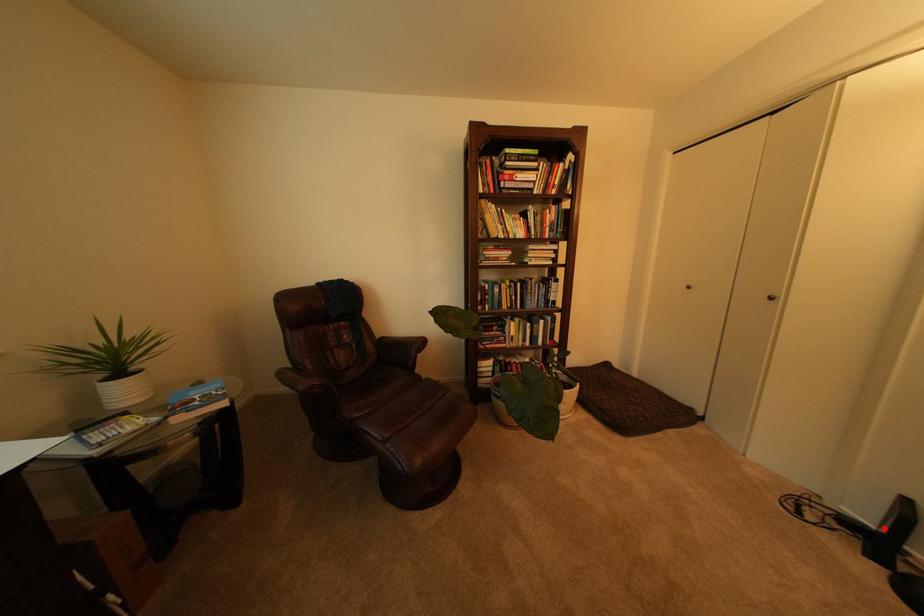
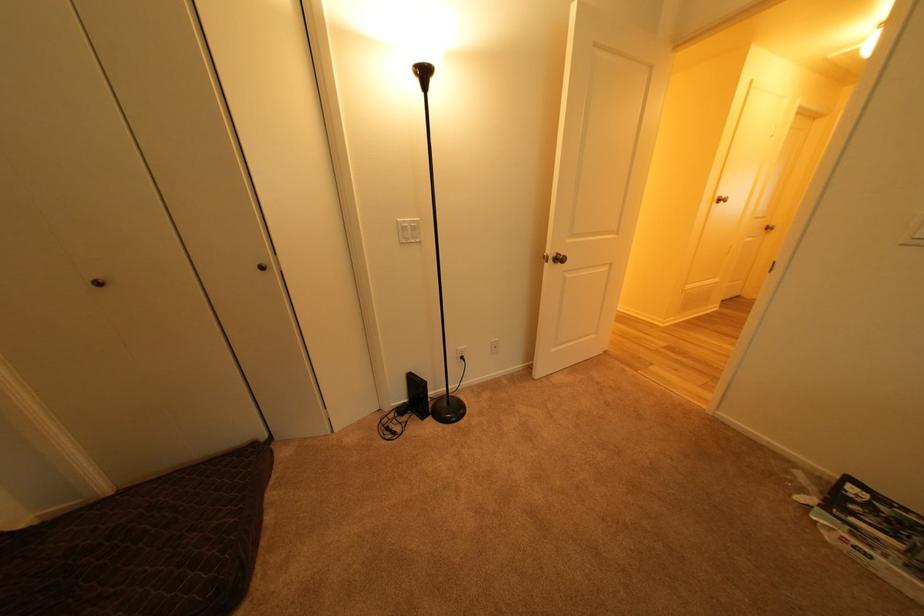
In the second image, find the point that corresponds to the highlighted location in the first image.

(417, 402)